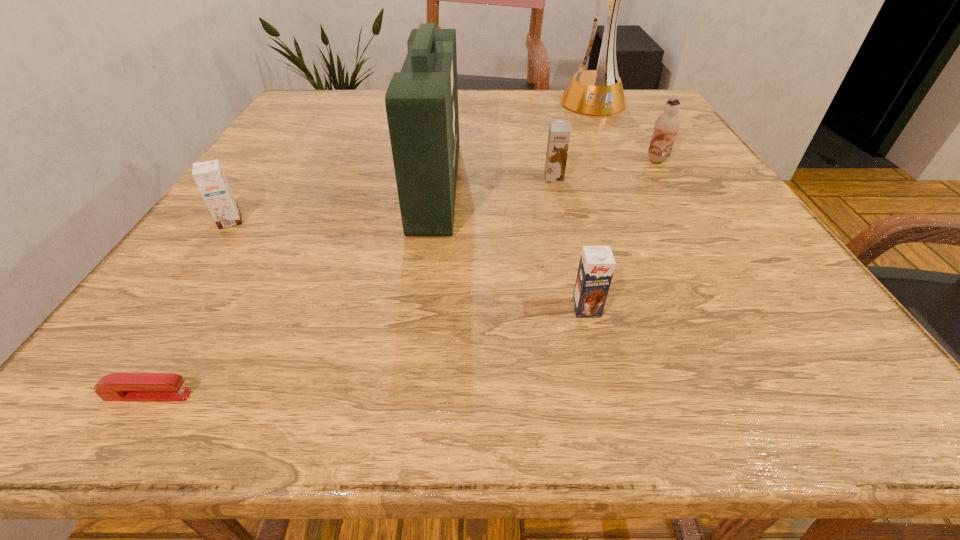
In the image, there is a desktop. At what (x,y) coordinates should I click in order to perform the action: click on vacant space at the near left corner. Please return your answer as a coordinate pair (x, y). Looking at the image, I should click on (157, 359).

The width and height of the screenshot is (960, 540). In order to click on vacant space at the far right corner in this screenshot , I will do `click(651, 112)`.

In the image, there is a desktop. At what (x,y) coordinates should I click in order to perform the action: click on vacant space at the near right corner. Please return your answer as a coordinate pair (x, y). Image resolution: width=960 pixels, height=540 pixels. Looking at the image, I should click on (834, 347).

Locate an element on the screen. free space that is in between the second tallest object and the shortest object is located at coordinates (292, 289).

Locate an element on the screen. Image resolution: width=960 pixels, height=540 pixels. unoccupied area between the second nearest object and the stapler is located at coordinates (368, 352).

Find the location of a particular element. vacant space that's between the nearest chocolate milk and the nearest object is located at coordinates (368, 352).

Identify the location of vacant space that's between the third nearest chocolate milk and the third farthest chocolate milk. The image size is (960, 540). (392, 200).

The image size is (960, 540). I want to click on empty location between the sixth farthest object and the second nearest chocolate milk, so click(x=408, y=265).

I want to click on vacant area between the third nearest chocolate milk and the rightmost chocolate milk, so click(606, 169).

Where is `vacant area between the second nearest chocolate milk and the nearest object`? Image resolution: width=960 pixels, height=540 pixels. vacant area between the second nearest chocolate milk and the nearest object is located at coordinates (189, 308).